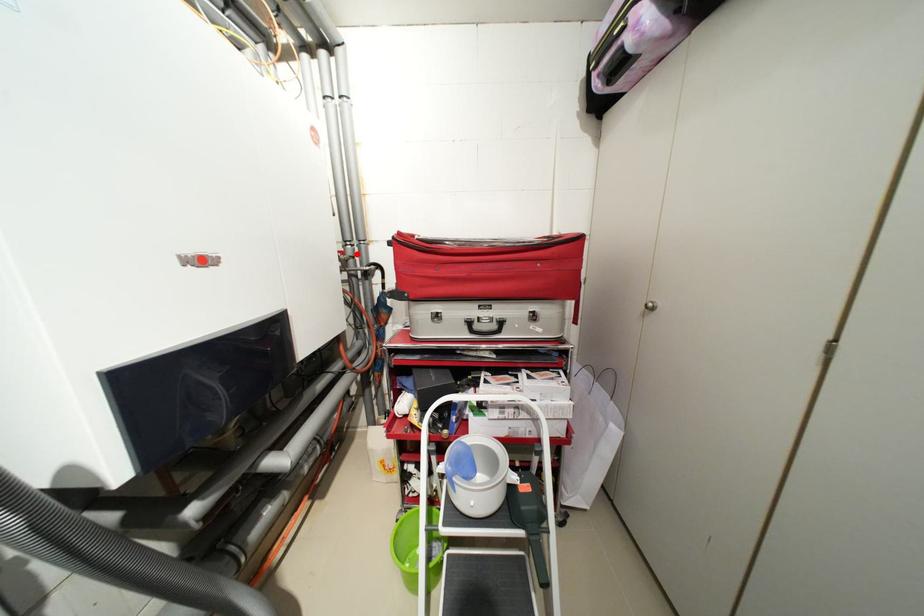
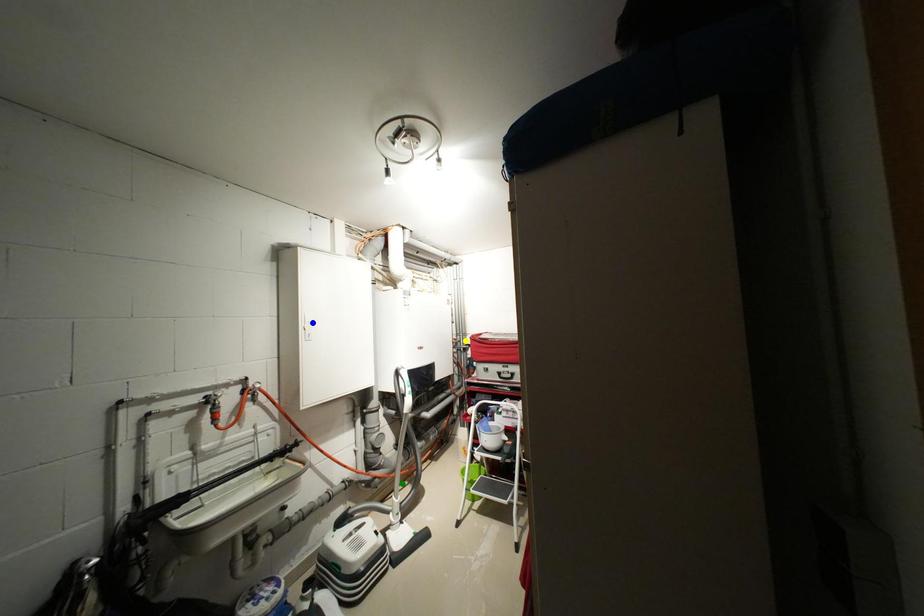
Question: I am providing you with two images of the same scene from different viewpoints. A red point is marked on the first image. You are given multiple points on the second image. Which point in image 2 represents the same 3d spot as the red point in image 1?

Choices:
 (A) blue point
 (B) green point
 (C) yellow point

Answer: (C)